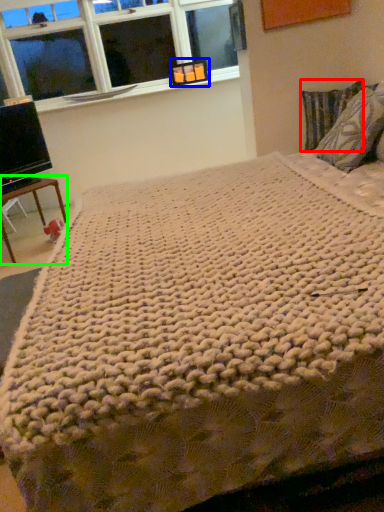
Question: Estimate the real-world distances between objects in this image. Which object is closer to pillow (highlighted by a red box), picture frame (highlighted by a blue box) or table (highlighted by a green box)?

Choices:
 (A) picture frame
 (B) table

Answer: (A)